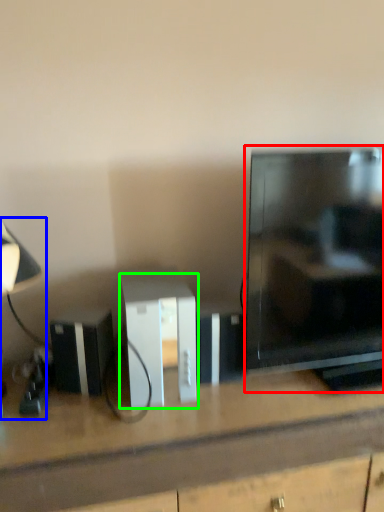
Question: Which object is the closest to the television (highlighted by a red box)? Choose among these: table lamp (highlighted by a blue box) or cabinetry (highlighted by a green box).

Choices:
 (A) table lamp
 (B) cabinetry

Answer: (B)